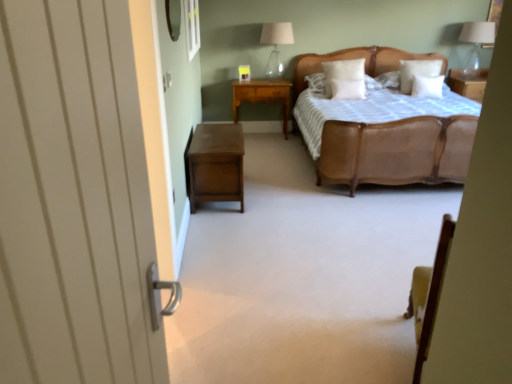
Question: Can you confirm if white soft pillow at center, which is the fourth pillow in right-to-left order, is positioned to the left of transparent glass window at upper center?

Choices:
 (A) yes
 (B) no

Answer: (B)

Question: Considering the relative sizes of white soft pillow at center, which ranks as the 1th pillow in left-to-right order, and transparent glass window at upper center in the image provided, is white soft pillow at center, which ranks as the 1th pillow in left-to-right order, bigger than transparent glass window at upper center?

Choices:
 (A) yes
 (B) no

Answer: (A)

Question: Would you consider white soft pillow at center, which ranks as the 1th pillow in left-to-right order, to be distant from transparent glass window at upper center?

Choices:
 (A) yes
 (B) no

Answer: (A)

Question: Is white soft pillow at center, which is the fourth pillow in right-to-left order, looking in the opposite direction of transparent glass window at upper center?

Choices:
 (A) no
 (B) yes

Answer: (A)

Question: From the image's perspective, is white soft pillow at center, which is the fourth pillow in right-to-left order, located beneath transparent glass window at upper center?

Choices:
 (A) yes
 (B) no

Answer: (A)

Question: Considering the relative sizes of white soft pillow at center, which ranks as the 1th pillow in left-to-right order, and transparent glass window at upper center in the image provided, is white soft pillow at center, which ranks as the 1th pillow in left-to-right order, taller than transparent glass window at upper center?

Choices:
 (A) no
 (B) yes

Answer: (B)

Question: Can you confirm if white soft pillow at center, the second pillow when ordered from left to right, is wider than white wooden door at left?

Choices:
 (A) yes
 (B) no

Answer: (A)

Question: Considering the relative sizes of white soft pillow at center, which appears as the third pillow when viewed from the right, and white wooden door at left in the image provided, is white soft pillow at center, which appears as the third pillow when viewed from the right, taller than white wooden door at left?

Choices:
 (A) no
 (B) yes

Answer: (A)

Question: From a real-world perspective, is white soft pillow at center, which appears as the third pillow when viewed from the right, under white wooden door at left?

Choices:
 (A) yes
 (B) no

Answer: (A)

Question: Considering the relative positions of white soft pillow at center, which appears as the third pillow when viewed from the right, and white wooden door at left in the image provided, is white soft pillow at center, which appears as the third pillow when viewed from the right, to the left of white wooden door at left from the viewer's perspective?

Choices:
 (A) yes
 (B) no

Answer: (B)

Question: Considering the relative positions of white soft pillow at center, which appears as the third pillow when viewed from the right, and white wooden door at left in the image provided, is white soft pillow at center, which appears as the third pillow when viewed from the right, to the right of white wooden door at left from the viewer's perspective?

Choices:
 (A) no
 (B) yes

Answer: (B)

Question: From a real-world perspective, does white soft pillow at center, the second pillow when ordered from left to right, stand above white wooden door at left?

Choices:
 (A) yes
 (B) no

Answer: (B)

Question: From a real-world perspective, is leather bed at center under brown wood nightstand at lower left, the first nightstand in the front-to-back sequence?

Choices:
 (A) yes
 (B) no

Answer: (B)